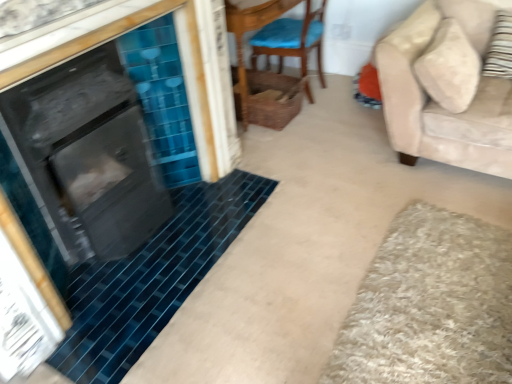
Question: From a real-world perspective, is striped fabric pillow at right below beige shaggy bath mat at lower right?

Choices:
 (A) no
 (B) yes

Answer: (A)

Question: Considering the relative sizes of striped fabric pillow at right and beige shaggy bath mat at lower right in the image provided, is striped fabric pillow at right smaller than beige shaggy bath mat at lower right?

Choices:
 (A) no
 (B) yes

Answer: (B)

Question: Is striped fabric pillow at right far away from beige shaggy bath mat at lower right?

Choices:
 (A) no
 (B) yes

Answer: (B)

Question: From a real-world perspective, is striped fabric pillow at right over beige shaggy bath mat at lower right?

Choices:
 (A) yes
 (B) no

Answer: (A)

Question: Is striped fabric pillow at right wider than beige shaggy bath mat at lower right?

Choices:
 (A) no
 (B) yes

Answer: (A)

Question: Does striped fabric pillow at right have a lesser width compared to beige shaggy bath mat at lower right?

Choices:
 (A) yes
 (B) no

Answer: (A)

Question: Is wooden chair with blue cushion at center facing towards woven brown basket at center?

Choices:
 (A) no
 (B) yes

Answer: (A)

Question: From a real-world perspective, is wooden chair with blue cushion at center positioned under woven brown basket at center based on gravity?

Choices:
 (A) yes
 (B) no

Answer: (B)

Question: Is wooden chair with blue cushion at center positioned with its back to woven brown basket at center?

Choices:
 (A) yes
 (B) no

Answer: (B)

Question: Is wooden chair with blue cushion at center not near woven brown basket at center?

Choices:
 (A) yes
 (B) no

Answer: (B)

Question: Is wooden chair with blue cushion at center in contact with woven brown basket at center?

Choices:
 (A) no
 (B) yes

Answer: (A)

Question: Is woven brown basket at center completely or partially inside wooden chair with blue cushion at center?

Choices:
 (A) no
 (B) yes

Answer: (A)

Question: From a real-world perspective, is woven wicker basket at upper center on top of striped fabric pillow at right?

Choices:
 (A) no
 (B) yes

Answer: (A)